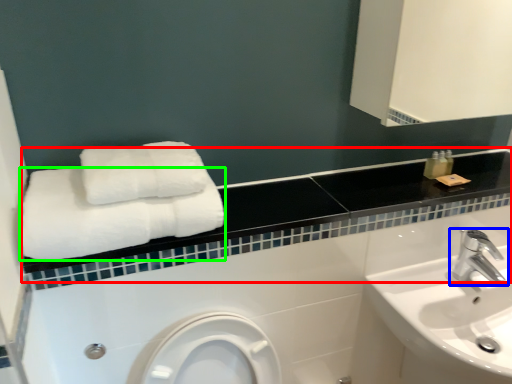
Question: Based on their relative distances, which object is farther from balustrade (highlighted by a red box)? Choose from tap (highlighted by a blue box) and towel (highlighted by a green box).

Choices:
 (A) tap
 (B) towel

Answer: (A)